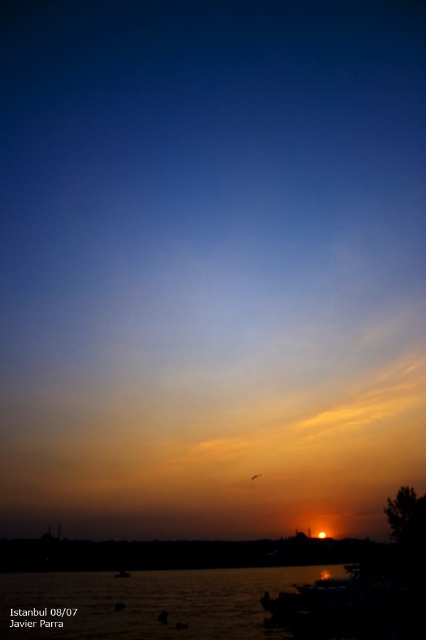
Can you confirm if silvery reflective water at lower center is shorter than metallic silver boat at lower center?

Incorrect, silvery reflective water at lower center's height does not fall short of metallic silver boat at lower center's.

Who is more forward, (146, 634) or (379, 586)?

Point (379, 586)

Who is more distant from viewer, (60, 586) or (356, 579)?

Point (60, 586)

I want to click on silvery reflective water at lower center, so click(x=147, y=604).